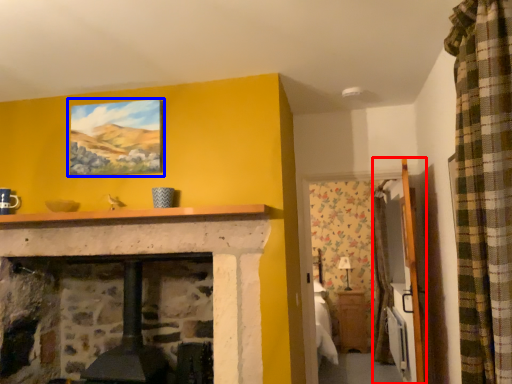
Question: Which of the following is the farthest to the observer, armoire (highlighted by a red box) or picture frame (highlighted by a blue box)?

Choices:
 (A) armoire
 (B) picture frame

Answer: (B)